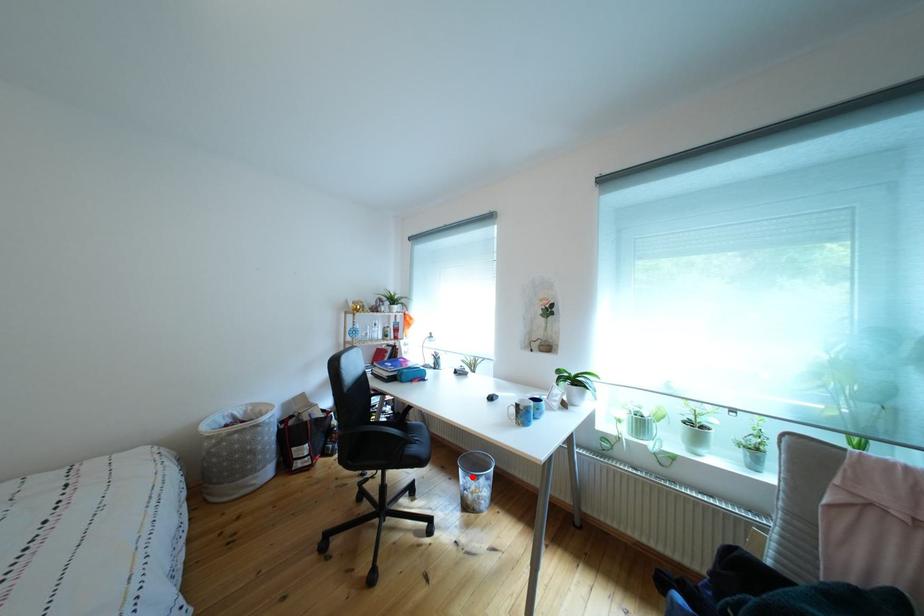
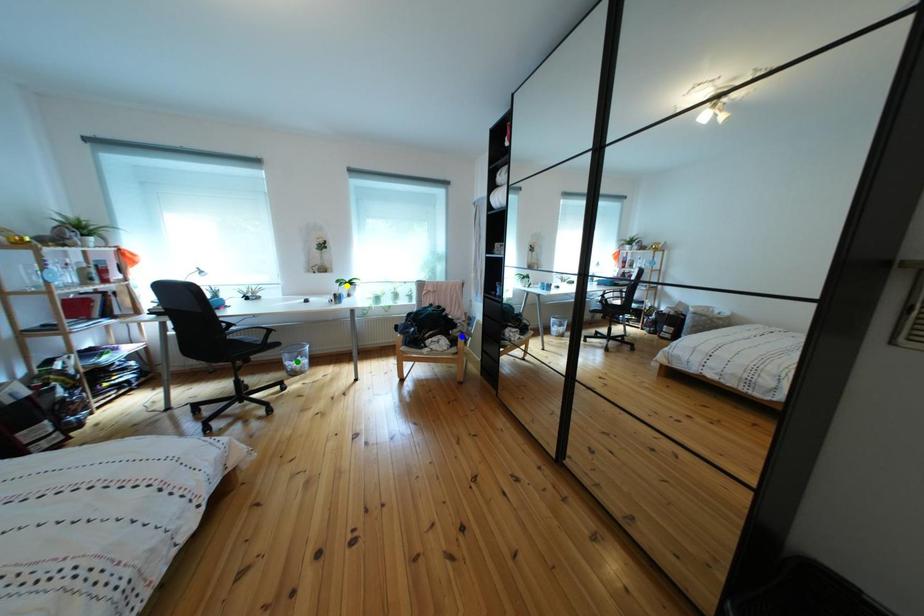
Question: I am providing you with two images of the same scene from different viewpoints. A red point is marked on the first image. You are given multiple points on the second image. Can you choose the point in image 2 that corresponds to the point in image 1?

Choices:
 (A) yellow point
 (B) green point
 (C) blue point

Answer: (B)